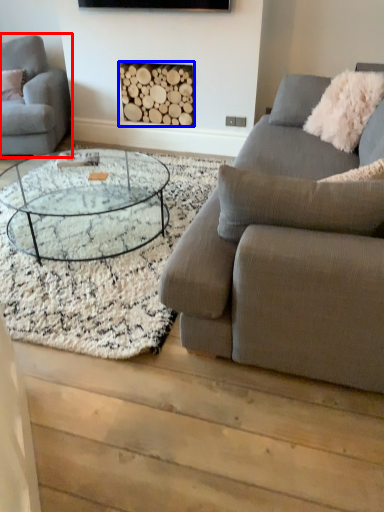
Question: Which object appears farthest to the camera in this image, studio couch (highlighted by a red box) or fireplace (highlighted by a blue box)?

Choices:
 (A) studio couch
 (B) fireplace

Answer: (B)